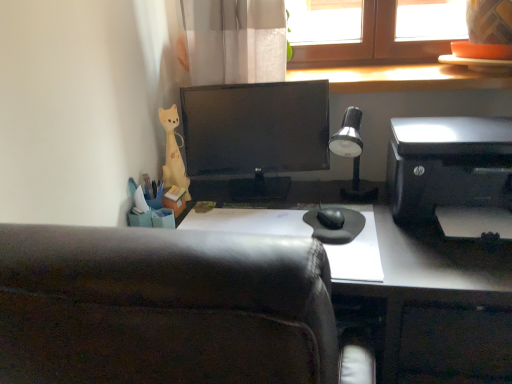
Question: Does wooden at upper right have a larger size compared to silver metallic desk lamp at upper right?

Choices:
 (A) yes
 (B) no

Answer: (A)

Question: Can you confirm if wooden at upper right is taller than silver metallic desk lamp at upper right?

Choices:
 (A) yes
 (B) no

Answer: (B)

Question: From the image's perspective, does wooden at upper right appear lower than silver metallic desk lamp at upper right?

Choices:
 (A) no
 (B) yes

Answer: (A)

Question: Is silver metallic desk lamp at upper right inside wooden at upper right?

Choices:
 (A) yes
 (B) no

Answer: (B)

Question: Is wooden at upper right to the right of silver metallic desk lamp at upper right from the viewer's perspective?

Choices:
 (A) no
 (B) yes

Answer: (B)

Question: From a real-world perspective, is yellow matte figurine at upper left physically located above or below wooden at upper right?

Choices:
 (A) below
 (B) above

Answer: (A)

Question: Considering the positions of point (170, 173) and point (342, 69), is point (170, 173) closer or farther from the camera than point (342, 69)?

Choices:
 (A) closer
 (B) farther

Answer: (A)

Question: Considering the positions of yellow matte figurine at upper left and wooden at upper right in the image, is yellow matte figurine at upper left wider or thinner than wooden at upper right?

Choices:
 (A) wide
 (B) thin

Answer: (B)

Question: Is yellow matte figurine at upper left taller or shorter than wooden at upper right?

Choices:
 (A) short
 (B) tall

Answer: (B)

Question: Would you say leather at center is inside or outside black plastic printer at right?

Choices:
 (A) inside
 (B) outside

Answer: (B)

Question: Considering the positions of leather at center and black plastic printer at right in the image, is leather at center taller or shorter than black plastic printer at right?

Choices:
 (A) tall
 (B) short

Answer: (A)

Question: Is leather at center wider or thinner than black plastic printer at right?

Choices:
 (A) wide
 (B) thin

Answer: (B)

Question: From the image's perspective, relative to black plastic printer at right, is leather at center above or below?

Choices:
 (A) below
 (B) above

Answer: (A)

Question: Is wooden at upper right inside or outside of black plastic printer at right?

Choices:
 (A) outside
 (B) inside

Answer: (A)

Question: Considering their positions, is wooden at upper right located in front of or behind black plastic printer at right?

Choices:
 (A) front
 (B) behind

Answer: (B)